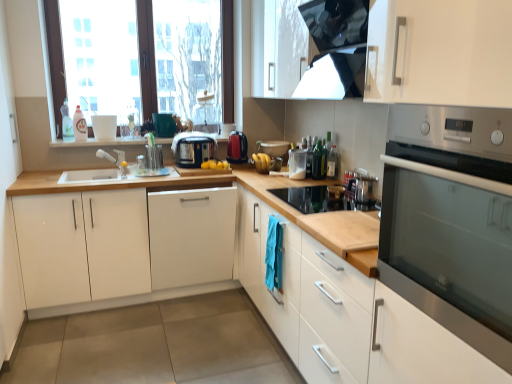
Locate an element on the screen. vacant region to the left of white plastic faucet at upper left is located at coordinates (80, 173).